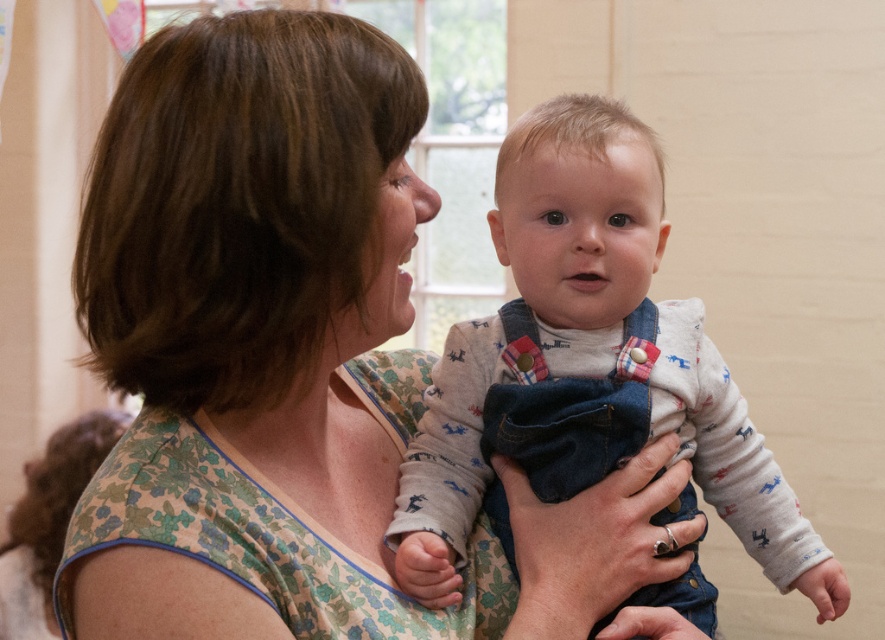
You are a fashion designer observing the image. You need to determine the arrangement of the floral fabric dress at center and denim overalls at center. Which one is positioned higher?

The floral fabric dress at center is above the denim overalls at center, so the floral fabric dress at center is positioned higher.

You are a fashion designer observing the scene. You need to determine which clothing item is shorter between the floral fabric dress at center and the denim overalls at center. Which one is shorter?

The floral fabric dress at center is shorter than the denim overalls at center.

You are standing 1 meter away from the image. There is a point at coordinates (156,609) in the image. If you want to touch this point, will your hand reach it?

The point at coordinates (156,609) is 73.32 centimeters from the viewer. Since you are standing 1 meter away, your hand can reach it because 73.32 cm is less than 1 meter.